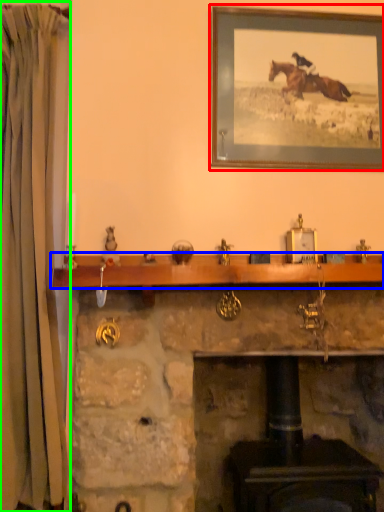
Question: Which object is the closest to the picture frame (highlighted by a red box)? Choose among these: mantle (highlighted by a blue box) or curtain (highlighted by a green box).

Choices:
 (A) mantle
 (B) curtain

Answer: (A)